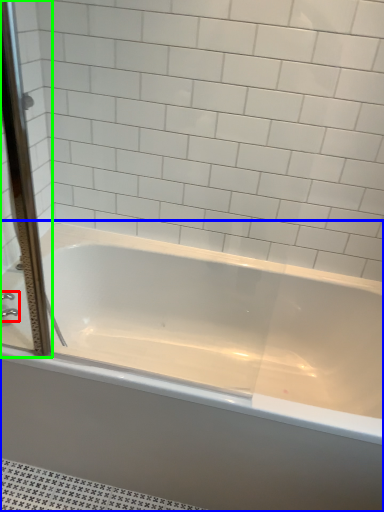
Question: Which object is the farthest from faucet (highlighted by a red box)? Choose among these: bathtub (highlighted by a blue box) or screen door (highlighted by a green box).

Choices:
 (A) bathtub
 (B) screen door

Answer: (A)